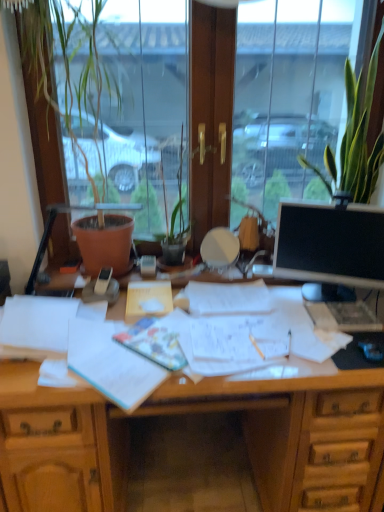
Question: Is transparent glass window at center completely or partially outside of green leafy plant at upper right?

Choices:
 (A) yes
 (B) no

Answer: (A)

Question: Does transparent glass window at center have a lesser height compared to green leafy plant at upper right?

Choices:
 (A) no
 (B) yes

Answer: (A)

Question: From a real-world perspective, is transparent glass window at center physically below green leafy plant at upper right?

Choices:
 (A) no
 (B) yes

Answer: (B)

Question: Is the surface of transparent glass window at center in direct contact with green leafy plant at upper right?

Choices:
 (A) yes
 (B) no

Answer: (B)

Question: Is transparent glass window at center closer to the viewer compared to green leafy plant at upper right?

Choices:
 (A) no
 (B) yes

Answer: (A)

Question: From the image's perspective, would you say transparent glass window at center is positioned over green leafy plant at upper right?

Choices:
 (A) yes
 (B) no

Answer: (B)

Question: Considering the relative sizes of black glossy monitor at right and transparent glass window at center in the image provided, is black glossy monitor at right shorter than transparent glass window at center?

Choices:
 (A) yes
 (B) no

Answer: (A)

Question: Does black glossy monitor at right appear on the left side of transparent glass window at center?

Choices:
 (A) yes
 (B) no

Answer: (B)

Question: Is black glossy monitor at right looking in the opposite direction of transparent glass window at center?

Choices:
 (A) yes
 (B) no

Answer: (A)

Question: Are black glossy monitor at right and transparent glass window at center making contact?

Choices:
 (A) no
 (B) yes

Answer: (A)

Question: Is the position of black glossy monitor at right less distant than that of transparent glass window at center?

Choices:
 (A) yes
 (B) no

Answer: (B)

Question: From the image's perspective, is black glossy monitor at right under transparent glass window at center?

Choices:
 (A) yes
 (B) no

Answer: (A)

Question: Is wooden desk at center next to black glossy monitor at right?

Choices:
 (A) yes
 (B) no

Answer: (B)